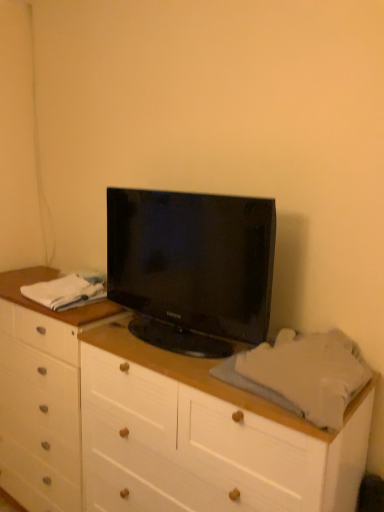
What do you see at coordinates (192, 267) in the screenshot? Image resolution: width=384 pixels, height=512 pixels. I see `black glossy tv at center` at bounding box center [192, 267].

Identify the location of black glossy tv at center. Image resolution: width=384 pixels, height=512 pixels. (192, 267).

Find the location of a particular element. The width and height of the screenshot is (384, 512). black glossy tv at center is located at coordinates (192, 267).